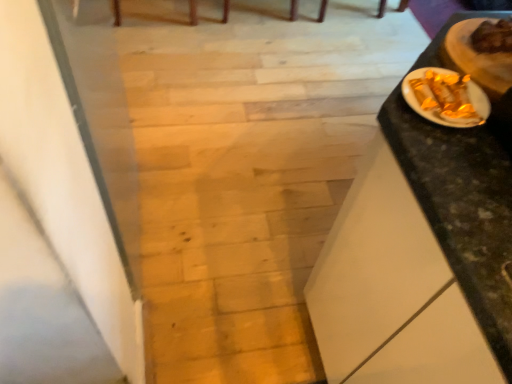
In order to click on unoccupied area in front of gold foil candy at right, which is counted as the 2th food, starting from the right in this screenshot , I will do `click(465, 168)`.